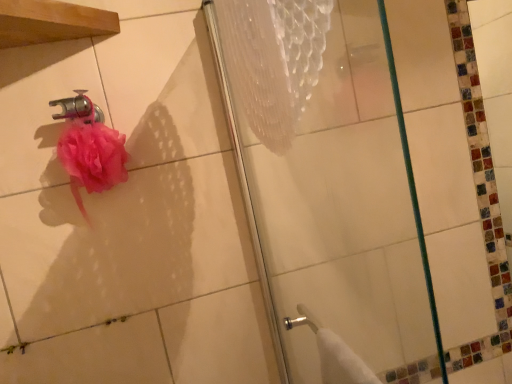
Question: From a real-world perspective, is polished chrome faucet at upper left positioned over transparent glass shower door at center based on gravity?

Choices:
 (A) no
 (B) yes

Answer: (B)

Question: Can you confirm if polished chrome faucet at upper left is wider than transparent glass shower door at center?

Choices:
 (A) yes
 (B) no

Answer: (A)

Question: Is polished chrome faucet at upper left thinner than transparent glass shower door at center?

Choices:
 (A) yes
 (B) no

Answer: (B)

Question: Is polished chrome faucet at upper left surrounding transparent glass shower door at center?

Choices:
 (A) no
 (B) yes

Answer: (A)

Question: Can you confirm if polished chrome faucet at upper left is taller than transparent glass shower door at center?

Choices:
 (A) yes
 (B) no

Answer: (B)

Question: Looking at their shapes, would you say pink fluffy sponge at upper left is wider or thinner than transparent glass shower door at center?

Choices:
 (A) thin
 (B) wide

Answer: (B)

Question: Is point (105, 147) closer or farther from the camera than point (359, 296)?

Choices:
 (A) farther
 (B) closer

Answer: (B)

Question: From their relative heights in the image, would you say pink fluffy sponge at upper left is taller or shorter than transparent glass shower door at center?

Choices:
 (A) short
 (B) tall

Answer: (A)

Question: In the image, is pink fluffy sponge at upper left on the left side or the right side of transparent glass shower door at center?

Choices:
 (A) left
 (B) right

Answer: (A)

Question: In terms of height, does transparent glass shower door at center look taller or shorter compared to pink fluffy sponge at upper left?

Choices:
 (A) short
 (B) tall

Answer: (B)

Question: Based on their sizes in the image, would you say transparent glass shower door at center is bigger or smaller than pink fluffy sponge at upper left?

Choices:
 (A) big
 (B) small

Answer: (A)

Question: Looking at their shapes, would you say transparent glass shower door at center is wider or thinner than pink fluffy sponge at upper left?

Choices:
 (A) thin
 (B) wide

Answer: (A)

Question: Which is correct: transparent glass shower door at center is inside pink fluffy sponge at upper left, or outside of it?

Choices:
 (A) outside
 (B) inside

Answer: (A)

Question: Looking at their shapes, would you say pink fluffy sponge at upper left is wider or thinner than polished chrome faucet at upper left?

Choices:
 (A) thin
 (B) wide

Answer: (B)

Question: Is pink fluffy sponge at upper left taller or shorter than polished chrome faucet at upper left?

Choices:
 (A) short
 (B) tall

Answer: (B)